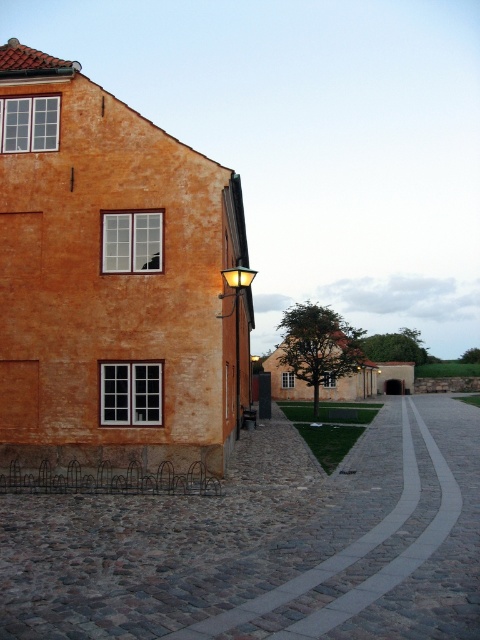
Question: Which of the following is the farthest from the observer?

Choices:
 (A) metallic wall-mounted light at upper right
 (B) cobblestone path at lower center

Answer: (A)

Question: Which point is farther from the camera taking this photo?

Choices:
 (A) (420, 524)
 (B) (235, 278)

Answer: (B)

Question: Is cobblestone path at lower center smaller than metallic wall-mounted light at upper right?

Choices:
 (A) no
 (B) yes

Answer: (A)

Question: Is cobblestone path at lower center further to camera compared to metallic wall-mounted light at upper right?

Choices:
 (A) yes
 (B) no

Answer: (B)

Question: Considering the relative positions of cobblestone path at lower center and metallic wall-mounted light at upper right in the image provided, where is cobblestone path at lower center located with respect to metallic wall-mounted light at upper right?

Choices:
 (A) below
 (B) above

Answer: (A)